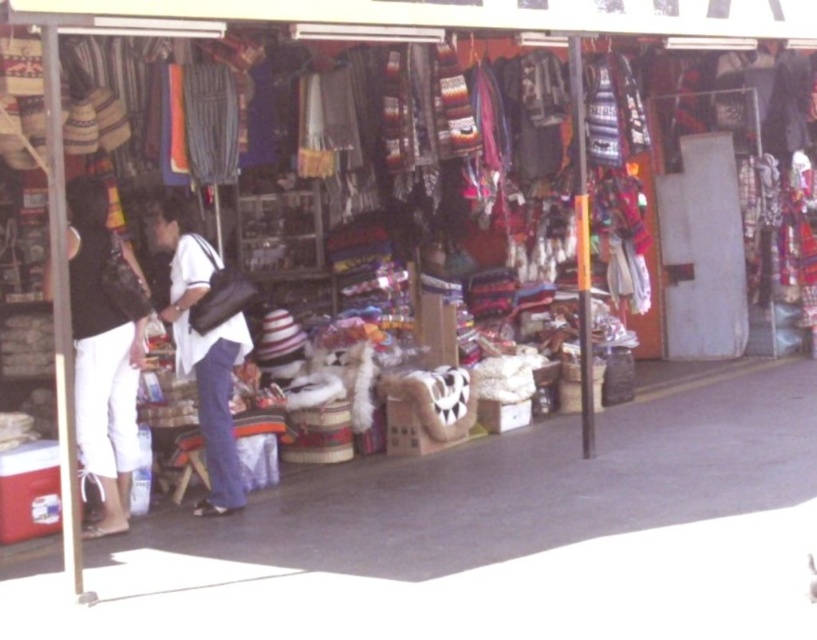
You are a customer at the market stall. You see the white cotton pants at left and the white matte shirt at center. Which item is positioned higher up compared to the other?

The white cotton pants at left is above the white matte shirt at center, so the white cotton pants at left is positioned higher up.

You are standing in front of the market stall and want to determine the relative positions of two points marked in the scene. Which of the two points, point 1 at coordinates (68, 244) or point 2 at coordinates (222, 372), is closer to your viewpoint?

Point 1 at coordinates (68, 244) is closer to your viewpoint than point 2 at coordinates (222, 372).

You are a customer at the market stall and want to know if the white cotton pants at left will fit into your suitcase, which can only accommodate items taller than the white matte shirt at center. Can the pants fit?

The white cotton pants at left has a greater height compared to the white matte shirt at center, so the pants will fit into your suitcase since they are taller than the shirt.